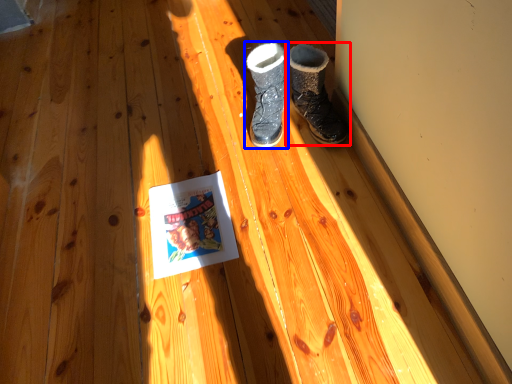
Question: Which object appears farthest to the camera in this image, footwear (highlighted by a red box) or footwear (highlighted by a blue box)?

Choices:
 (A) footwear
 (B) footwear

Answer: (B)